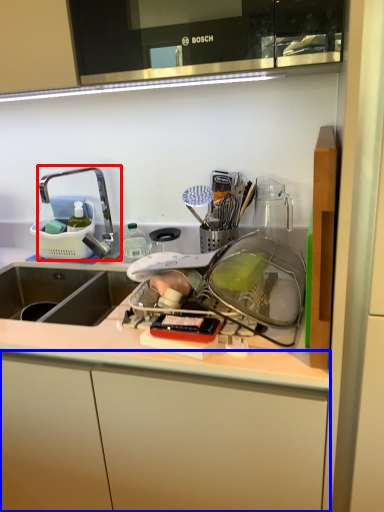
Question: Which of the following is the farthest to the observer, tap (highlighted by a red box) or cabinetry (highlighted by a blue box)?

Choices:
 (A) tap
 (B) cabinetry

Answer: (A)